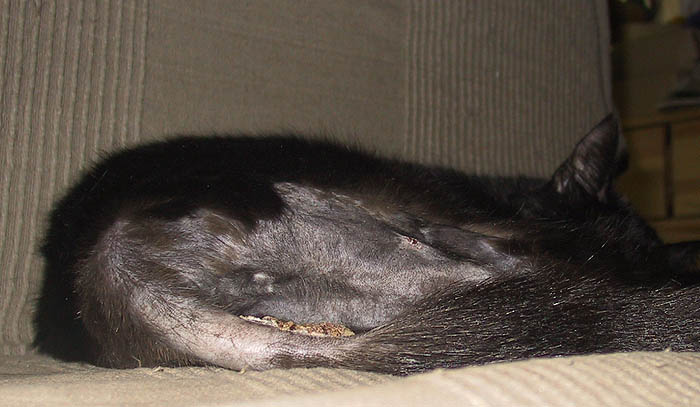
This screenshot has height=407, width=700. Find the location of `tan ribbed portion of blanket`. tan ribbed portion of blanket is located at coordinates (91, 61).